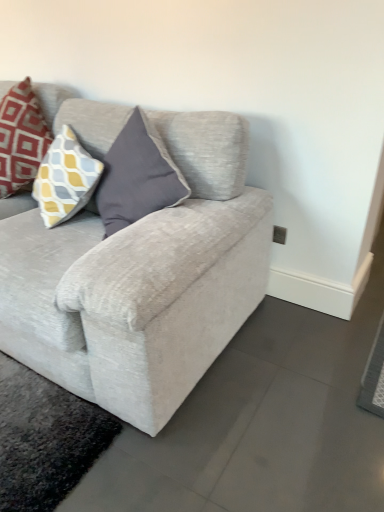
Question: Does light gray fabric couch at center appear on the right side of matte red pillow at upper left?

Choices:
 (A) yes
 (B) no

Answer: (A)

Question: Would you say light gray fabric couch at center contains matte red pillow at upper left?

Choices:
 (A) yes
 (B) no

Answer: (A)

Question: Could you tell me if light gray fabric couch at center is turned towards matte red pillow at upper left?

Choices:
 (A) yes
 (B) no

Answer: (B)

Question: Is light gray fabric couch at center further to the viewer compared to matte red pillow at upper left?

Choices:
 (A) yes
 (B) no

Answer: (B)

Question: Is light gray fabric couch at center at the left side of matte red pillow at upper left?

Choices:
 (A) no
 (B) yes

Answer: (A)

Question: Does light gray fabric couch at center have a lesser height compared to matte red pillow at upper left?

Choices:
 (A) yes
 (B) no

Answer: (B)

Question: Considering the relative positions of matte red pillow at upper left and light gray fabric couch at center in the image provided, is matte red pillow at upper left in front of light gray fabric couch at center?

Choices:
 (A) yes
 (B) no

Answer: (B)

Question: Is light gray fabric couch at center located within matte red pillow at upper left?

Choices:
 (A) no
 (B) yes

Answer: (A)

Question: Considering the relative sizes of matte red pillow at upper left and light gray fabric couch at center in the image provided, is matte red pillow at upper left wider than light gray fabric couch at center?

Choices:
 (A) yes
 (B) no

Answer: (B)

Question: From a real-world perspective, does matte red pillow at upper left sit lower than light gray fabric couch at center?

Choices:
 (A) no
 (B) yes

Answer: (A)

Question: From the image's perspective, is matte red pillow at upper left beneath light gray fabric couch at center?

Choices:
 (A) yes
 (B) no

Answer: (B)

Question: From a real-world perspective, is matte red pillow at upper left on top of light gray fabric couch at center?

Choices:
 (A) no
 (B) yes

Answer: (B)

Question: Does point (6, 117) appear closer or farther from the camera than point (96, 253)?

Choices:
 (A) closer
 (B) farther

Answer: (B)